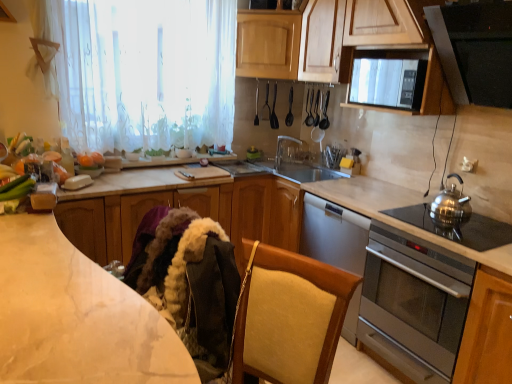
Question: Can you confirm if metallic silver spoon at upper center, the 2th appliance from the right, is positioned to the left of green matte cucumber at lower left?

Choices:
 (A) no
 (B) yes

Answer: (A)

Question: From a real-world perspective, does metallic silver spoon at upper center, the 2th appliance from the right, stand above green matte cucumber at lower left?

Choices:
 (A) yes
 (B) no

Answer: (A)

Question: From a real-world perspective, is metallic silver spoon at upper center, positioned as the 1th appliance in left-to-right order, beneath green matte cucumber at lower left?

Choices:
 (A) no
 (B) yes

Answer: (A)

Question: Is metallic silver spoon at upper center, the 2th appliance from the right, shorter than green matte cucumber at lower left?

Choices:
 (A) yes
 (B) no

Answer: (B)

Question: From the image's perspective, is metallic silver spoon at upper center, the 2th appliance from the right, located beneath green matte cucumber at lower left?

Choices:
 (A) yes
 (B) no

Answer: (B)

Question: Considering the relative sizes of metallic silver spoon at upper center, positioned as the 1th appliance in left-to-right order, and green matte cucumber at lower left in the image provided, is metallic silver spoon at upper center, positioned as the 1th appliance in left-to-right order, taller than green matte cucumber at lower left?

Choices:
 (A) no
 (B) yes

Answer: (B)

Question: Does marble at left, marked as the first countertop in a front-to-back arrangement, have a greater width compared to satin silver gas stove at right?

Choices:
 (A) yes
 (B) no

Answer: (B)

Question: From the image's perspective, would you say marble at left, marked as the first countertop in a front-to-back arrangement, is positioned over satin silver gas stove at right?

Choices:
 (A) no
 (B) yes

Answer: (A)

Question: From the image's perspective, does marble at left, marked as the first countertop in a front-to-back arrangement, appear lower than satin silver gas stove at right?

Choices:
 (A) yes
 (B) no

Answer: (A)

Question: From a real-world perspective, is marble at left, marked as the first countertop in a front-to-back arrangement, physically above satin silver gas stove at right?

Choices:
 (A) no
 (B) yes

Answer: (A)

Question: From a real-world perspective, is marble at left, marked as the first countertop in a front-to-back arrangement, under satin silver gas stove at right?

Choices:
 (A) yes
 (B) no

Answer: (A)

Question: Considering the relative positions of marble at left, marked as the first countertop in a front-to-back arrangement, and satin silver gas stove at right in the image provided, is marble at left, marked as the first countertop in a front-to-back arrangement, in front of satin silver gas stove at right?

Choices:
 (A) no
 (B) yes

Answer: (B)

Question: Can we say marble at left, marked as the first countertop in a front-to-back arrangement, lies outside clear plastic tap at center?

Choices:
 (A) yes
 (B) no

Answer: (A)